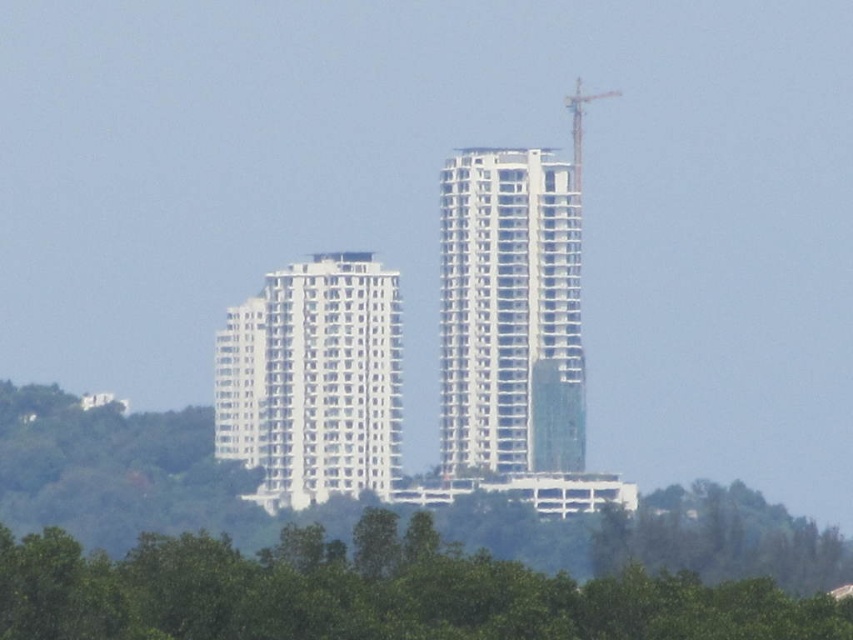
Question: Is white concrete building at center bigger than metallic gray crane at upper right?

Choices:
 (A) yes
 (B) no

Answer: (A)

Question: Is white smooth building at center positioned in front of metallic gray crane at upper right?

Choices:
 (A) no
 (B) yes

Answer: (B)

Question: Based on their relative distances, which object is nearer to the green leafy trees at lower center?

Choices:
 (A) white concrete building at center
 (B) white smooth building at center

Answer: (B)

Question: Among these points, which one is farthest from the camera?

Choices:
 (A) (569, 582)
 (B) (579, 154)
 (C) (497, 321)
 (D) (323, 456)

Answer: (A)

Question: Considering the real-world distances, which object is farthest from the metallic gray crane at upper right?

Choices:
 (A) white concrete building at center
 (B) white smooth building at center

Answer: (B)

Question: Does green leafy trees at lower center appear over metallic gray crane at upper right?

Choices:
 (A) yes
 (B) no

Answer: (B)